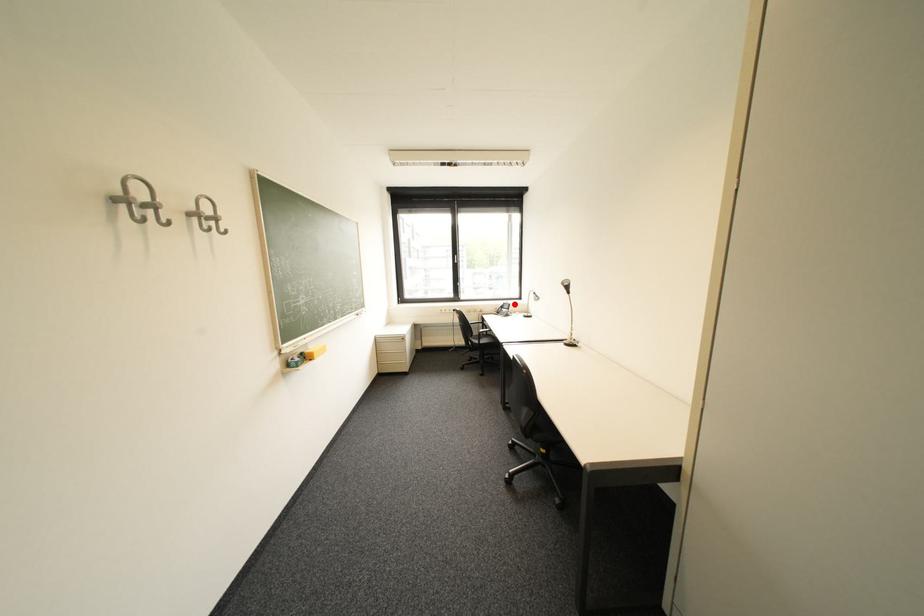
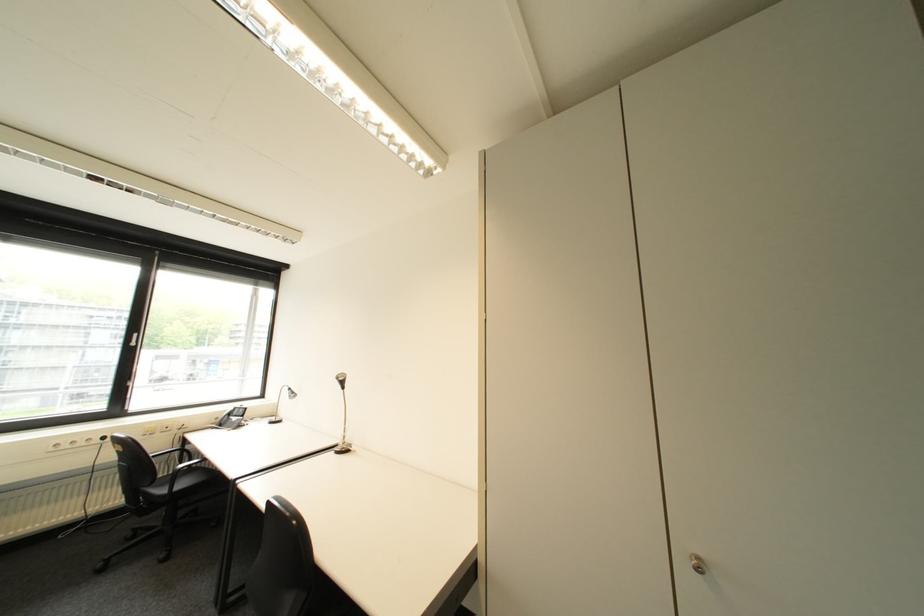
The point at the highlighted location is marked in the first image. Where is the corresponding point in the second image?

(246, 408)